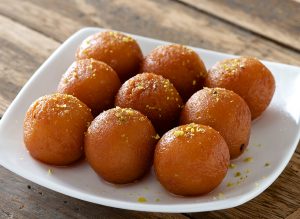
Identify the location of corner. (84, 28), (225, 205).